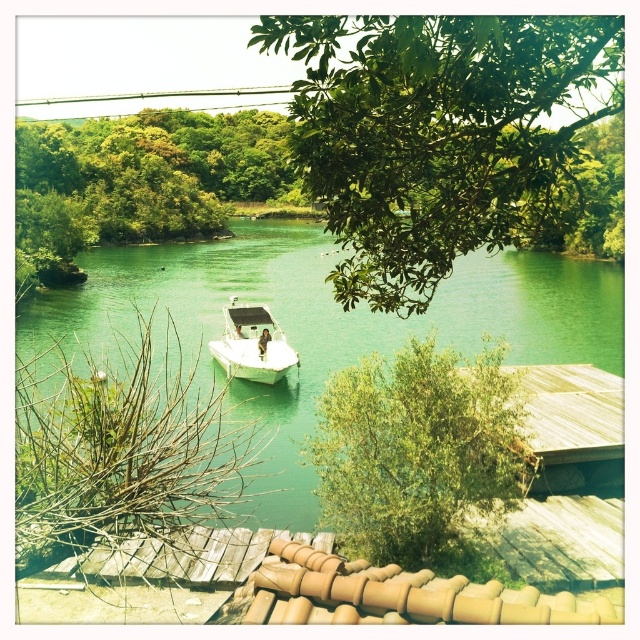
Question: Can you confirm if green glossy water at center is wider than white glossy boat at center?

Choices:
 (A) yes
 (B) no

Answer: (A)

Question: Can you confirm if green leafy tree at upper center is positioned above green leafy tree at center?

Choices:
 (A) no
 (B) yes

Answer: (B)

Question: Which point is farther from the camera taking this photo?

Choices:
 (A) (156, 324)
 (B) (520, 465)

Answer: (A)

Question: Which point is closer to the camera?

Choices:
 (A) (218, 342)
 (B) (452, 426)
 (C) (493, 173)

Answer: (C)

Question: Which is nearer to the green leafy tree at upper center?

Choices:
 (A) white glossy boat at center
 (B) green leafy tree at center

Answer: (B)

Question: From the image, what is the correct spatial relationship of green leafy tree at upper center in relation to white glossy boat at center?

Choices:
 (A) below
 (B) above

Answer: (B)